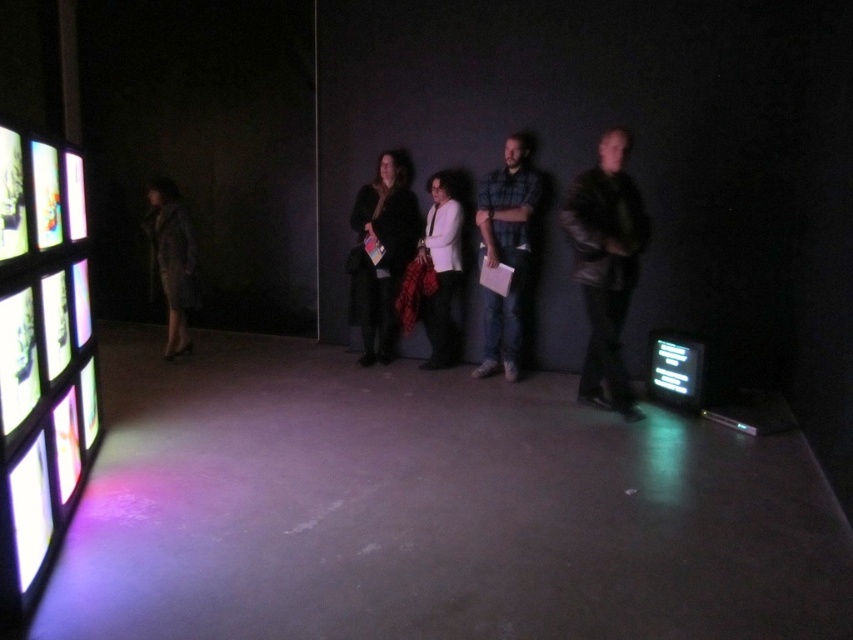
Is point (508, 161) less distant than point (695, 396)?

No, (508, 161) is behind (695, 396).

Does plaid flannel shirt at center have a larger size compared to black glossy screen at lower right?

Correct, plaid flannel shirt at center is larger in size than black glossy screen at lower right.

At what (x,y) coordinates should I click in order to perform the action: click on plaid flannel shirt at center. Please return your answer as a coordinate pair (x, y). Looking at the image, I should click on (506, 252).

Who is positioned more to the left, matte gray coat at left or black glossy screen at lower right?

From the viewer's perspective, matte gray coat at left appears more on the left side.

Does point (194, 250) lie in front of point (677, 352)?

No, (194, 250) is further to viewer.

Which is behind, point (175, 259) or point (674, 376)?

Point (175, 259)

At what (x,y) coordinates should I click in order to perform the action: click on matte gray coat at left. Please return your answer as a coordinate pair (x, y). Looking at the image, I should click on (172, 260).

Based on the photo, does plaid flannel shirt at center appear on the left side of matte gray coat at left?

No, plaid flannel shirt at center is not to the left of matte gray coat at left.

Is plaid flannel shirt at center further to the viewer compared to matte gray coat at left?

No, it is not.

Is point (509, 250) positioned after point (160, 257)?

No, (509, 250) is closer to viewer.

Where is `plaid flannel shirt at center`? The image size is (853, 640). plaid flannel shirt at center is located at coordinates (506, 252).